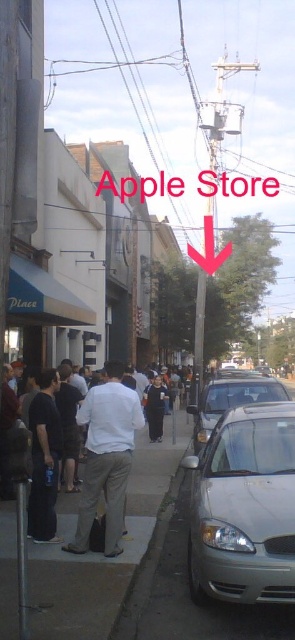
Question: Based on their relative distances, which object is nearer to the silver metallic car at lower right?

Choices:
 (A) gray concrete sidewalk at lower center
 (B) white matte shirt at center

Answer: (B)

Question: Can you confirm if silver metallic car at lower right is positioned below dark blue jeans at center?

Choices:
 (A) no
 (B) yes

Answer: (A)

Question: Which of these objects is positioned closest to the dark gray pants at center?

Choices:
 (A) silver metallic car at lower right
 (B) white matte shirt at center

Answer: (B)

Question: In this image, where is silver metallic car at lower right located relative to dark blue jeans at center?

Choices:
 (A) above
 (B) below

Answer: (A)

Question: Which of these objects is positioned farthest from the white matte shirt at center?

Choices:
 (A) gray concrete sidewalk at lower center
 (B) dark blue jeans at center
 (C) silver metallic car at lower right

Answer: (B)

Question: Does silver metallic car at lower right have a lesser width compared to silver metallic sedan at center?

Choices:
 (A) no
 (B) yes

Answer: (B)